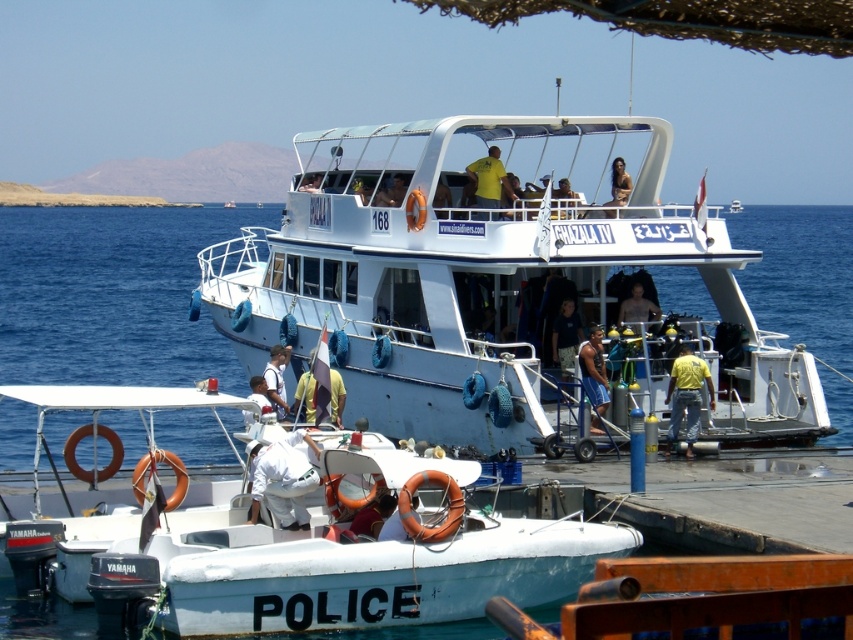
From the picture: You are a lifeguard on duty at the marina and notice a yellow matte shirt at upper center. Based on the coordinates provided, which object is located at point (489, 179)?

The yellow matte shirt at upper center is located at point (489, 179).